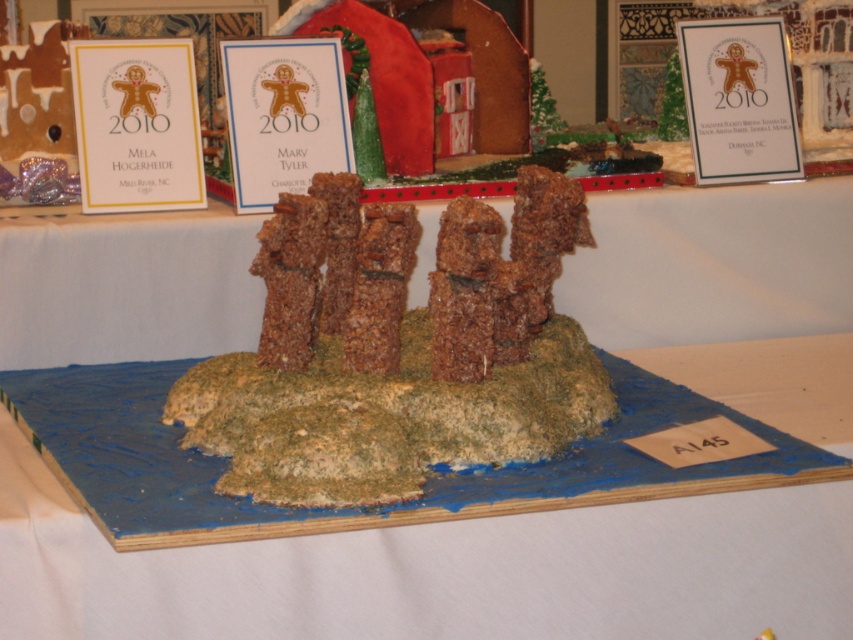
You are a judge at the gingerbread competition. You need to determine if the blue paperboard at center can fully cover the brown crumbly cake at center when placed over it. Can it?

The blue paperboard at center is wider than the brown crumbly cake at center, so yes, the blue paperboard at center can fully cover the brown crumbly cake at center when placed over it.

You are a judge at the gingerbread competition and need to determine if the blue paperboard at center can be moved to the right without touching the brown textured rice krispies treat at center. Is there enough space between them?

The blue paperboard at center is positioned on the left side of brown textured rice krispies treat at center, so moving it to the right would require space between them. However, since the description only states their relative positions and not the distance, it is unclear if there is enough space to move without touching.